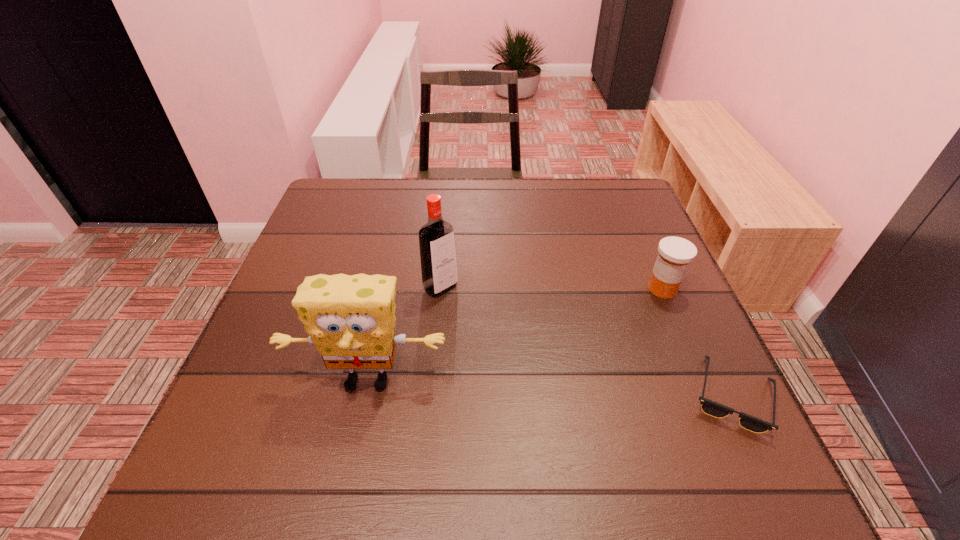
Locate an element on the screen. Image resolution: width=960 pixels, height=540 pixels. free space on the desktop that is between the sponge and the sunglasses and is positioned on the front and back of the vodka is located at coordinates (550, 388).

Image resolution: width=960 pixels, height=540 pixels. What are the coordinates of `vacant spot on the desktop that is between the sponge and the shortest object and is positioned on the label of the medicine` in the screenshot? It's located at (496, 386).